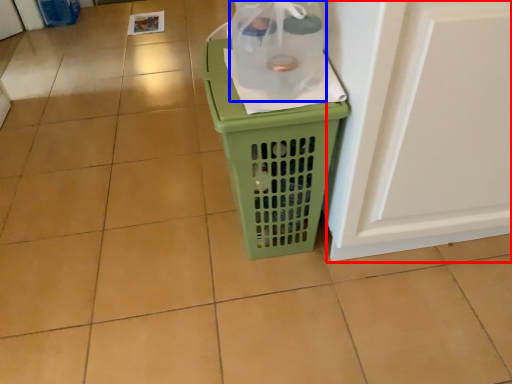
Question: Which object is closer to the camera taking this photo, screen door (highlighted by a red box) or bottle (highlighted by a blue box)?

Choices:
 (A) screen door
 (B) bottle

Answer: (A)